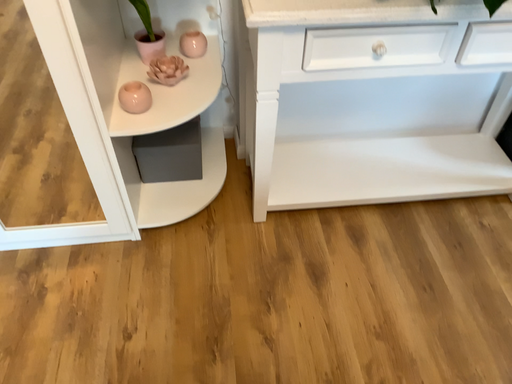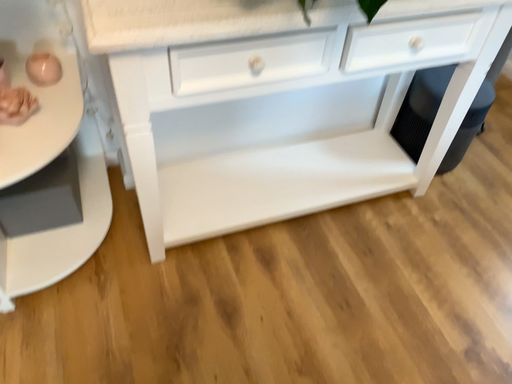
Question: Which way did the camera rotate in the video?

Choices:
 (A) rotated right
 (B) rotated left

Answer: (A)